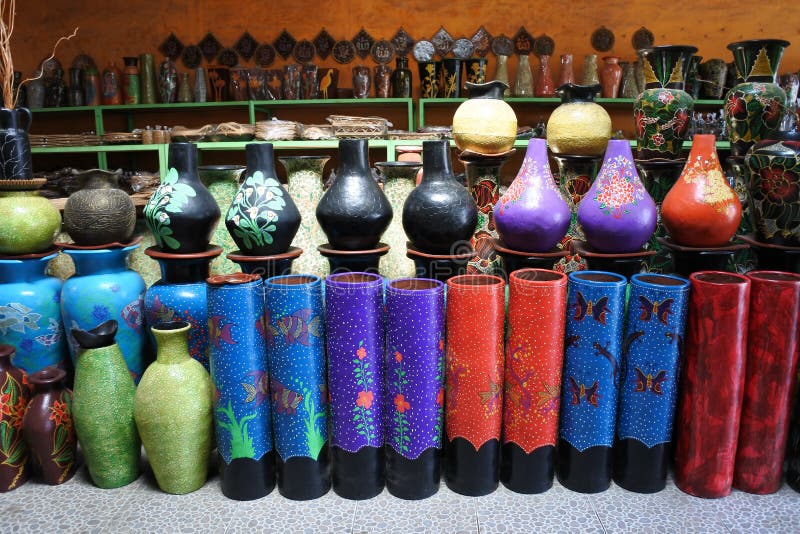
This screenshot has width=800, height=534. What are the coordinates of `jug` in the screenshot? It's located at (557, 133), (482, 125).